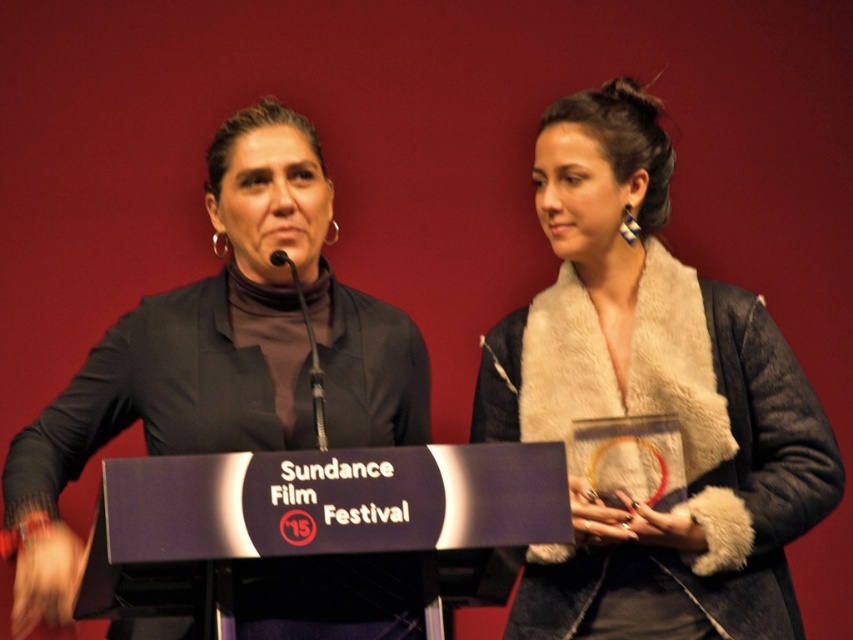
In the scene shown: You are standing in the audience at the Sundance Film Festival event. There is a point at coordinates point (674, 592) that you want to look at. If your eyes are at 1.8 meters from the stage, will you be able to see that point clearly?

The distance of point (674, 592) from viewer is 1.93 meters. Since your eyes are at 1.8 meters from the stage, the point is slightly farther away than your eye level, so you might have a slight difficulty seeing it clearly unless you move closer.

You are a photographer at the Sundance Film Festival event. You need to take a closeup shot of the fuzzy white scarf at center. Where should you focus your camera to capture it precisely?

The fuzzy white scarf at center is located at the 2D coordinates point [653,401], so you should focus your camera precisely at that point to capture it.